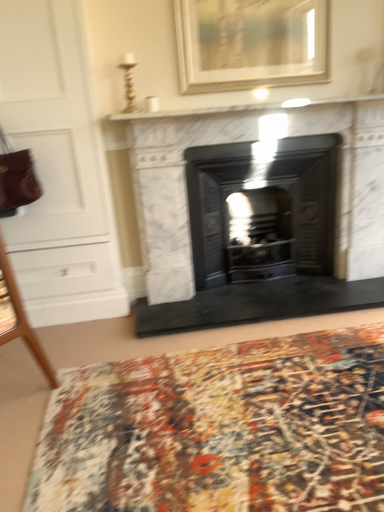
This screenshot has width=384, height=512. What are the coordinates of `multicolored woven rug at center` in the screenshot? It's located at (258, 303).

At what (x,y) coordinates should I click in order to perform the action: click on white marble shelf at upper center. Please return your answer as a coordinate pair (x, y). This screenshot has width=384, height=512. Looking at the image, I should click on (244, 108).

I want to click on matte black wood burning stove at center, so click(x=262, y=210).

Where is `doormat on the right of white marble shelf at upper center`? The image size is (384, 512). doormat on the right of white marble shelf at upper center is located at coordinates (258, 303).

Is multicolored woven rug at center spatially inside white marble shelf at upper center, or outside of it?

The correct answer is: outside.

Considering the relative sizes of multicolored woven rug at center and white marble shelf at upper center in the image provided, is multicolored woven rug at center wider than white marble shelf at upper center?

Correct, the width of multicolored woven rug at center exceeds that of white marble shelf at upper center.

Which is closer to the camera, (301,300) or (281,111)?

Point (301,300).

Is point (331, 125) behind point (188, 325)?

Yes, point (331, 125) is farther from viewer.

Is white marble fireplace at center turned away from multicolored woven rug at center?

No, multicolored woven rug at center is not at the back of white marble fireplace at center.

You are a GUI agent. You are given a task and a screenshot of the screen. Output one action in this format:
    pyautogui.click(x=<x>, y=<y>)
    Task: Click on the doormat on the right of white marble fireplace at center
    This screenshot has width=384, height=512.
    Given the screenshot: What is the action you would take?
    pyautogui.click(x=258, y=303)

From the image's perspective, is white marble fireplace at center located above or below multicolored woven rug at center?

Clearly, from the image's perspective, white marble fireplace at center is above multicolored woven rug at center.

Measure the distance from multicolored woven mat at lower center to multicolored woven rug at center.

29.28 inches.

Is point (223, 389) closer to camera compared to point (212, 288)?

Yes.

From the image's perspective, which is below, multicolored woven mat at lower center or multicolored woven rug at center?

multicolored woven mat at lower center appears lower in the image.

Is multicolored woven mat at lower center shorter than multicolored woven rug at center?

Indeed, multicolored woven mat at lower center has a lesser height compared to multicolored woven rug at center.

Which object is wider, multicolored woven rug at center or gold/wooden picture frame at upper center?

Wider between the two is multicolored woven rug at center.

Would you say multicolored woven rug at center contains gold/wooden picture frame at upper center?

No, gold/wooden picture frame at upper center is not surrounded by multicolored woven rug at center.

Does multicolored woven rug at center have a greater height compared to gold/wooden picture frame at upper center?

No.

From the picture: Which object is positioned more to the right, white marble fireplace at center or white glossy dresser at left?

white marble fireplace at center.

Who is taller, white marble fireplace at center or white glossy dresser at left?

With more height is white glossy dresser at left.

Is white marble fireplace at center bigger or smaller than white glossy dresser at left?

white marble fireplace at center is smaller than white glossy dresser at left.

Is matte black wood burning stove at center thinner than gold/wooden picture frame at upper center?

No.

Can you confirm if matte black wood burning stove at center is positioned to the right of gold/wooden picture frame at upper center?

Yes, matte black wood burning stove at center is to the right of gold/wooden picture frame at upper center.

Does matte black wood burning stove at center turn towards gold/wooden picture frame at upper center?

No, matte black wood burning stove at center is not aimed at gold/wooden picture frame at upper center.

Would you say multicolored woven rug at center is a long distance from white marble fireplace at center?

Actually, multicolored woven rug at center and white marble fireplace at center are a little close together.

Looking at their sizes, would you say multicolored woven rug at center is wider or thinner than white marble fireplace at center?

In the image, multicolored woven rug at center appears to be wider than white marble fireplace at center.

Consider the image. How many degrees apart are the facing directions of multicolored woven rug at center and white marble fireplace at center?

The angle between the facing direction of multicolored woven rug at center and the facing direction of white marble fireplace at center is 0.00132 degrees.

Image resolution: width=384 pixels, height=512 pixels. I want to click on doormat lying on the right of white marble shelf at upper center, so click(x=258, y=303).

At what (x,y) coordinates should I click in order to perform the action: click on fireplace located above the multicolored woven rug at center (from the image's perspective). Please return your answer as a coordinate pair (x, y). This screenshot has width=384, height=512. Looking at the image, I should click on (174, 186).

When comparing their distances from white marble fireplace at center, does matte black wood burning stove at center or multicolored woven mat at lower center seem further?

Among the two, multicolored woven mat at lower center is located further to white marble fireplace at center.

When comparing their distances from multicolored woven rug at center, does white glossy dresser at left or multicolored woven mat at lower center seem further?

white glossy dresser at left is further to multicolored woven rug at center.

Based on the photo, when comparing their distances from matte black wood burning stove at center, does white glossy dresser at left or multicolored woven mat at lower center seem closer?

white glossy dresser at left is positioned closer to the anchor matte black wood burning stove at center.

Considering their positions, is white marble fireplace at center positioned closer to multicolored woven mat at lower center than multicolored woven rug at center?

Based on the image, multicolored woven rug at center appears to be nearer to multicolored woven mat at lower center.

Considering their positions, is multicolored woven rug at center positioned closer to gold/wooden picture frame at upper center than white marble shelf at upper center?

white marble shelf at upper center.

Looking at this image, looking at the image, which one is located closer to multicolored woven rug at center, gold/wooden picture frame at upper center or matte black wood burning stove at center?

matte black wood burning stove at center.

Which object lies further to the anchor point white glossy dresser at left, white marble fireplace at center or multicolored woven rug at center?

The object further to white glossy dresser at left is multicolored woven rug at center.

Based on their spatial positions, is white marble fireplace at center or white marble shelf at upper center further from multicolored woven rug at center?

Among the two, white marble shelf at upper center is located further to multicolored woven rug at center.

The width and height of the screenshot is (384, 512). I want to click on wood burning stove between white glossy dresser at left and multicolored woven rug at center in the horizontal direction, so (x=262, y=210).

Find the location of a particular element. The width and height of the screenshot is (384, 512). mantle between gold/wooden picture frame at upper center and multicolored woven mat at lower center in the up-down direction is located at coordinates (244, 108).

The height and width of the screenshot is (512, 384). Find the location of `mat between white glossy dresser at left and multicolored woven rug at center in the horizontal direction`. mat between white glossy dresser at left and multicolored woven rug at center in the horizontal direction is located at coordinates (220, 429).

This screenshot has width=384, height=512. I want to click on dresser between white marble shelf at upper center and multicolored woven mat at lower center in the up-down direction, so click(x=57, y=168).